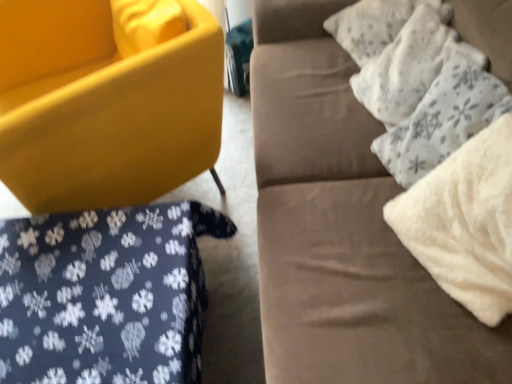
Question: Is suede couch at upper right not within matte yellow chair at lower left?

Choices:
 (A) no
 (B) yes

Answer: (B)

Question: Is suede couch at upper right at the left side of matte yellow chair at lower left?

Choices:
 (A) yes
 (B) no

Answer: (B)

Question: Is matte yellow chair at lower left completely or partially inside suede couch at upper right?

Choices:
 (A) no
 (B) yes

Answer: (A)

Question: From a real-world perspective, is suede couch at upper right positioned over matte yellow chair at lower left based on gravity?

Choices:
 (A) yes
 (B) no

Answer: (A)

Question: From a real-world perspective, does suede couch at upper right sit lower than matte yellow chair at lower left?

Choices:
 (A) yes
 (B) no

Answer: (B)

Question: From the image's perspective, is dark blue fabric with white snowflake pattern at lower left located above or below white fluffy pillow at right?

Choices:
 (A) below
 (B) above

Answer: (A)

Question: Is dark blue fabric with white snowflake pattern at lower left inside the boundaries of white fluffy pillow at right, or outside?

Choices:
 (A) outside
 (B) inside

Answer: (A)

Question: From their relative heights in the image, would you say dark blue fabric with white snowflake pattern at lower left is taller or shorter than white fluffy pillow at right?

Choices:
 (A) short
 (B) tall

Answer: (A)

Question: From a real-world perspective, is dark blue fabric with white snowflake pattern at lower left positioned above or below white fluffy pillow at right?

Choices:
 (A) below
 (B) above

Answer: (A)

Question: Is point (64, 175) positioned closer to the camera than point (192, 215)?

Choices:
 (A) farther
 (B) closer

Answer: (A)

Question: Considering the positions of matte yellow chair at lower left and dark blue fabric with white snowflake pattern at lower left in the image, is matte yellow chair at lower left bigger or smaller than dark blue fabric with white snowflake pattern at lower left?

Choices:
 (A) small
 (B) big

Answer: (B)

Question: Is matte yellow chair at lower left in front of or behind dark blue fabric with white snowflake pattern at lower left in the image?

Choices:
 (A) behind
 (B) front

Answer: (A)

Question: From their relative heights in the image, would you say matte yellow chair at lower left is taller or shorter than dark blue fabric with white snowflake pattern at lower left?

Choices:
 (A) short
 (B) tall

Answer: (B)

Question: Is dark blue fabric with white snowflake pattern at lower left wider or thinner than white textured pillow at upper right, the second pillow when ordered from bottom to top?

Choices:
 (A) wide
 (B) thin

Answer: (A)

Question: From the image's perspective, is dark blue fabric with white snowflake pattern at lower left above or below white textured pillow at upper right, the second pillow when ordered from bottom to top?

Choices:
 (A) above
 (B) below

Answer: (B)